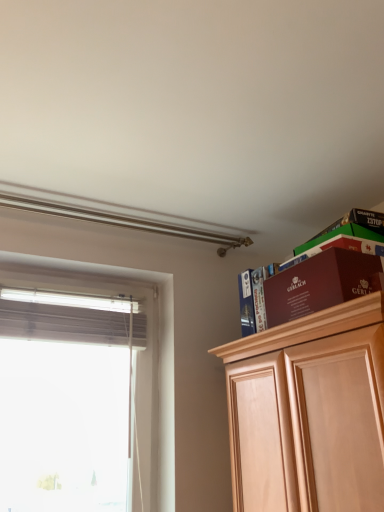
Question: Does point (66, 484) appear closer or farther from the camera than point (251, 304)?

Choices:
 (A) farther
 (B) closer

Answer: (A)

Question: Considering the positions of white matte window at left and matte brown book at upper right in the image, is white matte window at left bigger or smaller than matte brown book at upper right?

Choices:
 (A) big
 (B) small

Answer: (A)

Question: Estimate the real-world distances between objects in this image. Which object is farther from the matte brown book at upper right?

Choices:
 (A) maroon cardboard box at upper right
 (B) white matte window at left

Answer: (B)

Question: Estimate the real-world distances between objects in this image. Which object is closer to the maroon cardboard box at upper right?

Choices:
 (A) matte brown book at upper right
 (B) white matte window at left

Answer: (A)